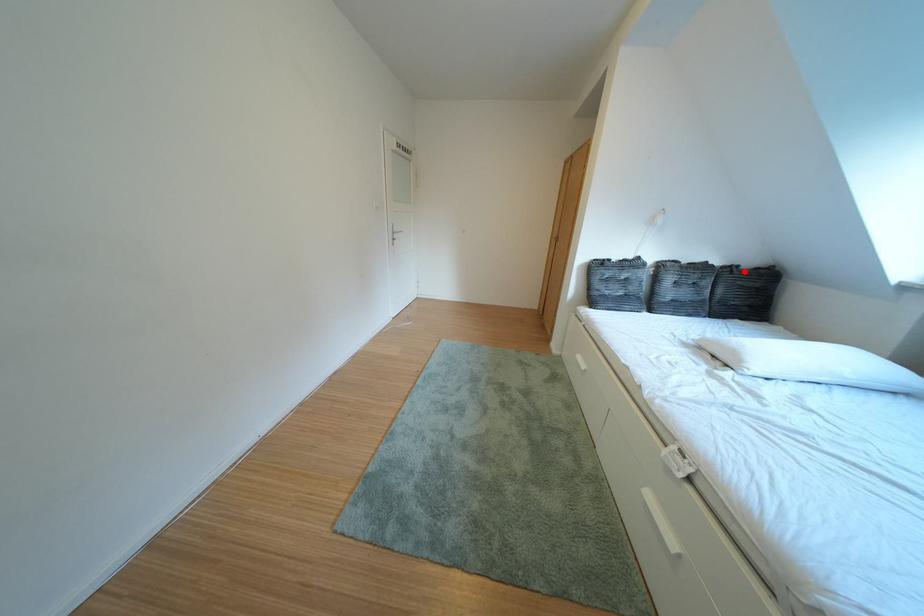
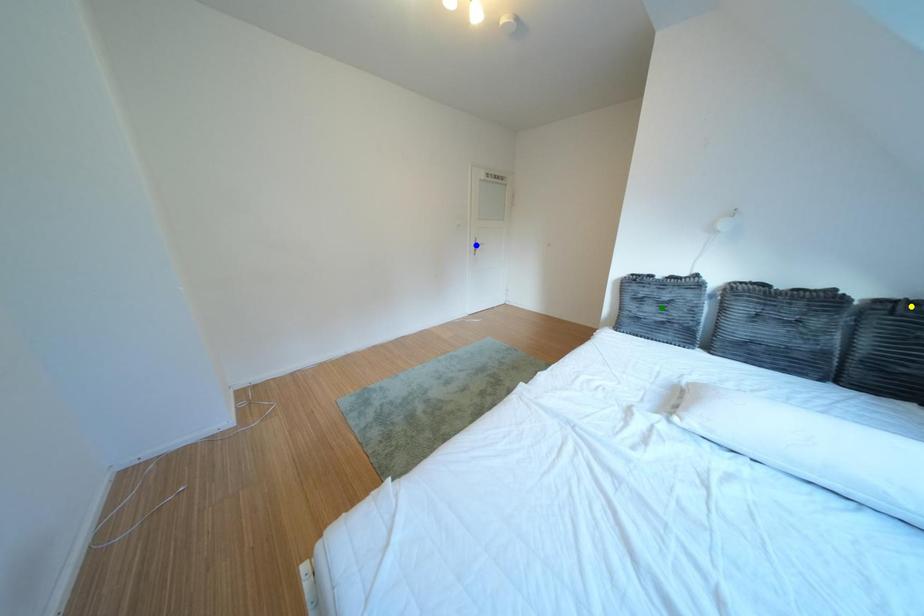
Question: I am providing you with two images of the same scene from different viewpoints. A red point is marked on the first image. You are given multiple points on the second image. Which point in image 2 is actually the same real-world point as the red point in image 1?

Choices:
 (A) yellow point
 (B) green point
 (C) blue point

Answer: (A)